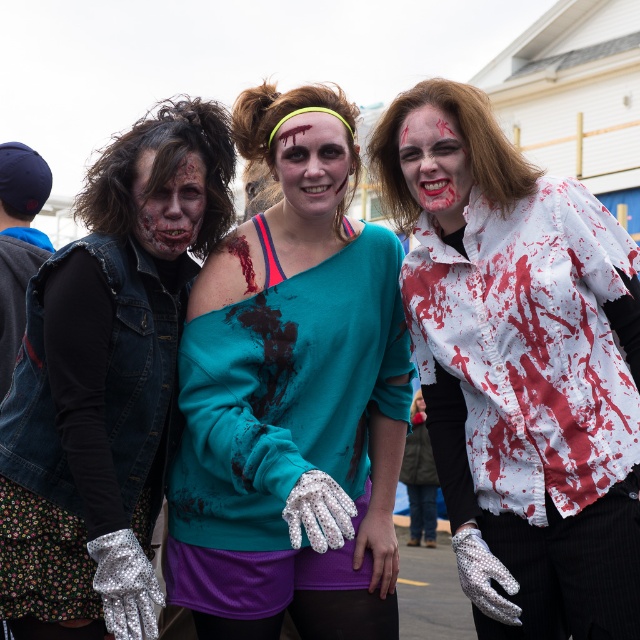
You are a photographer standing at the camera position. You want to take a closeup shot of the white textured shirt at center. Can you estimate how far you need to move forward to get the shirt into focus?

The white textured shirt at center is 24.64 meters away from the camera, so you need to move forward 24.64 meters to get it into focus.

You are a photographer at a zombie event. You want to capture a closeup of both the blood splattered face at center and the matte white face at center. Which face should you zoom in on first to ensure it fills the frame without cropping?

The blood splattered face at center is larger than the matte white face at center, so you should zoom in on the blood splattered face at center first to ensure it fills the frame without cropping.